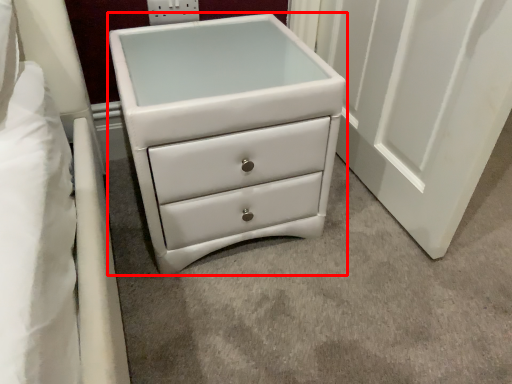
Question: From the image's perspective, what is the correct spatial positioning of chest of drawers (annotated by the red box) in reference to electric outlet?

Choices:
 (A) above
 (B) below

Answer: (B)